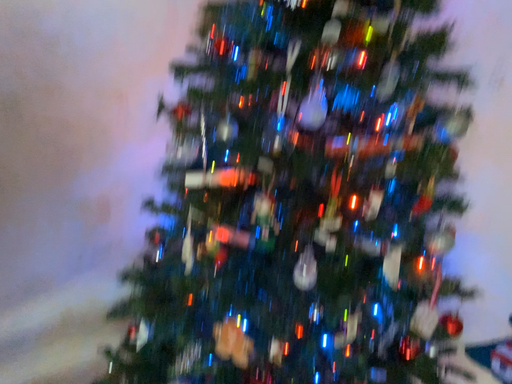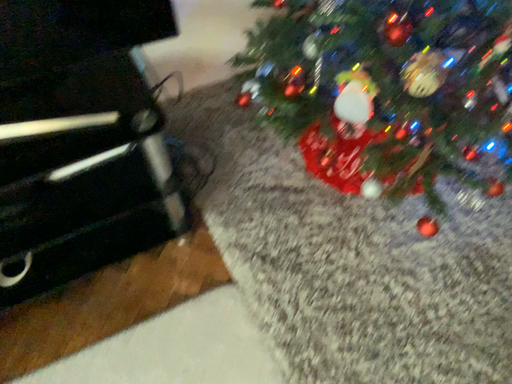
Question: Which way did the camera rotate in the video?

Choices:
 (A) rotated left
 (B) rotated right

Answer: (A)